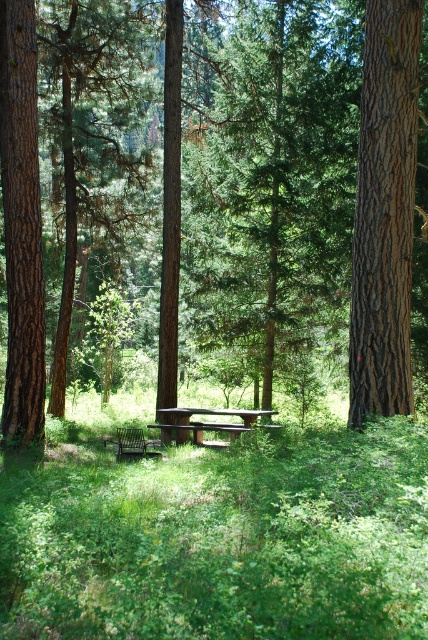
Does point (377, 116) come farther from viewer compared to point (201, 166)?

That is False.

Find the location of a particular element. brown rough tree at center is located at coordinates (321, 180).

Does point (419, 493) lie in front of point (366, 24)?

Yes, point (419, 493) is in front of point (366, 24).

Is green leafy grass at center taller than brown rough tree at center?

No, green leafy grass at center is not taller than brown rough tree at center.

Measure the distance between green leafy grass at center and camera.

green leafy grass at center and camera are 2.53 meters apart from each other.

Where is `green leafy grass at center`? This screenshot has width=428, height=640. green leafy grass at center is located at coordinates (219, 536).

Consider the image. Is the position of brown rough tree at center more distant than that of brown wooden picnic table at center?

No, it is not.

Is point (407, 88) positioned after point (187, 436)?

No, (407, 88) is in front of (187, 436).

You are a GUI agent. You are given a task and a screenshot of the screen. Output one action in this format:
    pyautogui.click(x=<x>, y=<y>)
    Task: Click on the brown rough tree at center
    
    Given the screenshot: What is the action you would take?
    pyautogui.click(x=321, y=180)